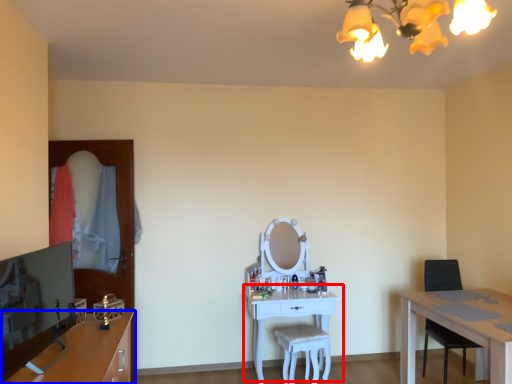
Question: Among these objects, which one is farthest to the camera, table (highlighted by a red box) or cabinetry (highlighted by a blue box)?

Choices:
 (A) table
 (B) cabinetry

Answer: (A)